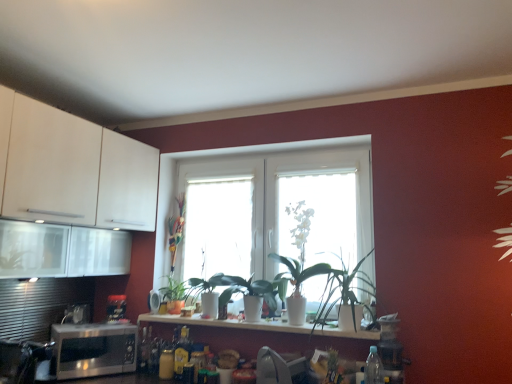
This screenshot has width=512, height=384. In order to click on free space in front of metallic black toaster at lower left, the 1th appliance from the right in this screenshot , I will do `click(104, 328)`.